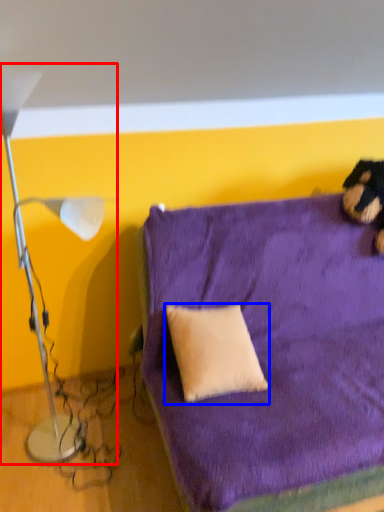
Question: Which point is further to the camera, lamp (highlighted by a red box) or pillow (highlighted by a blue box)?

Choices:
 (A) lamp
 (B) pillow

Answer: (B)